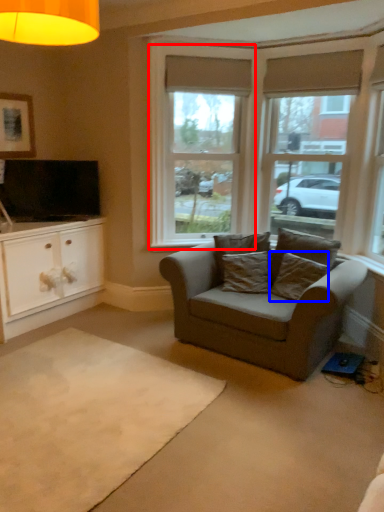
Question: Among these objects, which one is farthest to the camera, window (highlighted by a red box) or pillow (highlighted by a blue box)?

Choices:
 (A) window
 (B) pillow

Answer: (A)